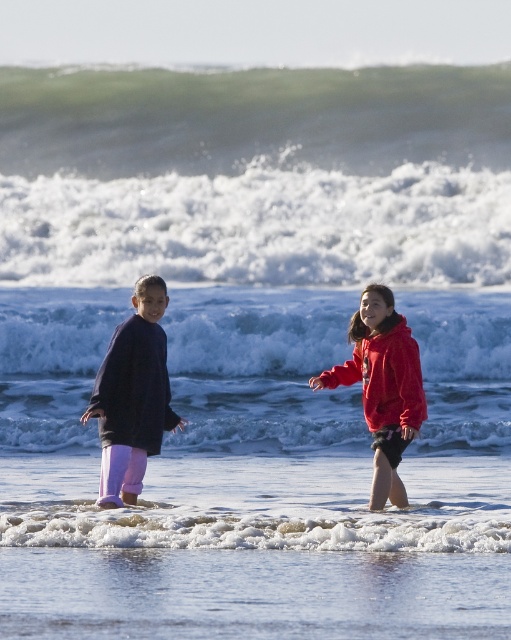
You are a photographer at the beach. You want to capture a photo where the white frothy wave at center is clearly visible above the red fleece hoodie at center. Based on the scene description, is this possible?

The white frothy wave at center is shorter than the red fleece hoodie at center, so it cannot be seen above the red fleece hoodie at center in the photo.

You are a photographer trying to capture the exact center of the image. According to the coordinates provided, what is located at the point [257,330]?

The point [257,330] corresponds to the white frothy wave at center.

You are a photographer trying to capture a photo of both children at the beach. You notice two points marked in the scene. The first point is at coordinate point (310, 508) and the second is at point (383, 484). Which point is closer to the camera?

Point (383, 484) is closer to the camera because point (310, 508) is behind it.